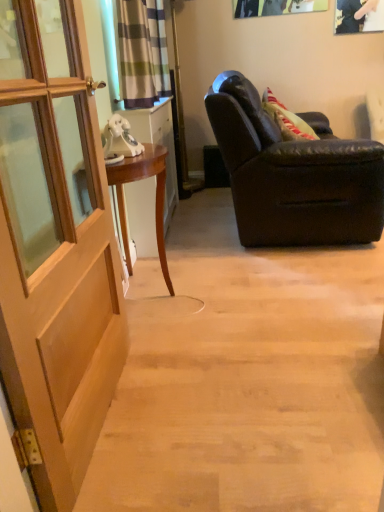
Identify the location of free space in front of matte black leather armchair at right. (281, 298).